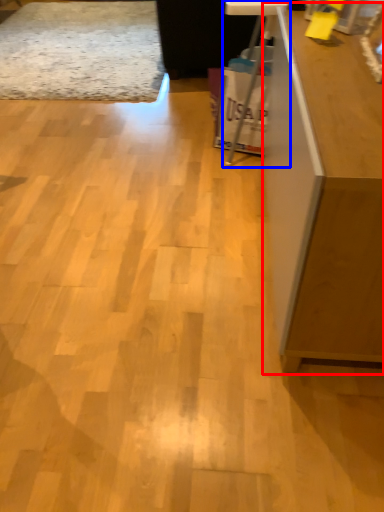
Question: Which point is closer to the camera, furniture (highlighted by a red box) or computer desk (highlighted by a blue box)?

Choices:
 (A) furniture
 (B) computer desk

Answer: (A)